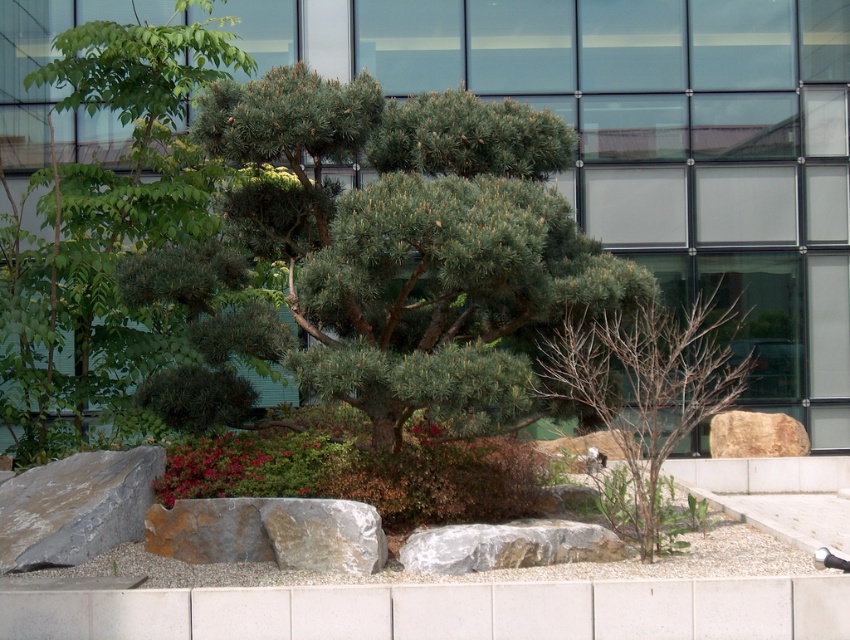
Question: Does smooth gray rock at center have a larger size compared to brown rough rock at center?

Choices:
 (A) no
 (B) yes

Answer: (A)

Question: Which of the following is the closest to the observer?

Choices:
 (A) brown rough rock at center
 (B) gray/rough rock at center
 (C) smooth gray rock at center

Answer: (C)

Question: Which point is farther to the camera?

Choices:
 (A) smooth gray rock at center
 (B) green needle-like at center
 (C) brown rough rock at center
 (D) green leafy tree at upper left

Answer: (C)

Question: Does bare wood tree at center appear on the left side of gray/rough rock at center?

Choices:
 (A) yes
 (B) no

Answer: (B)

Question: Which of the following is the closest to the observer?

Choices:
 (A) (486, 548)
 (B) (647, 353)
 (C) (768, 416)

Answer: (A)

Question: Is the position of gray rough rock at lower left less distant than that of brown rough rock at center?

Choices:
 (A) no
 (B) yes

Answer: (B)